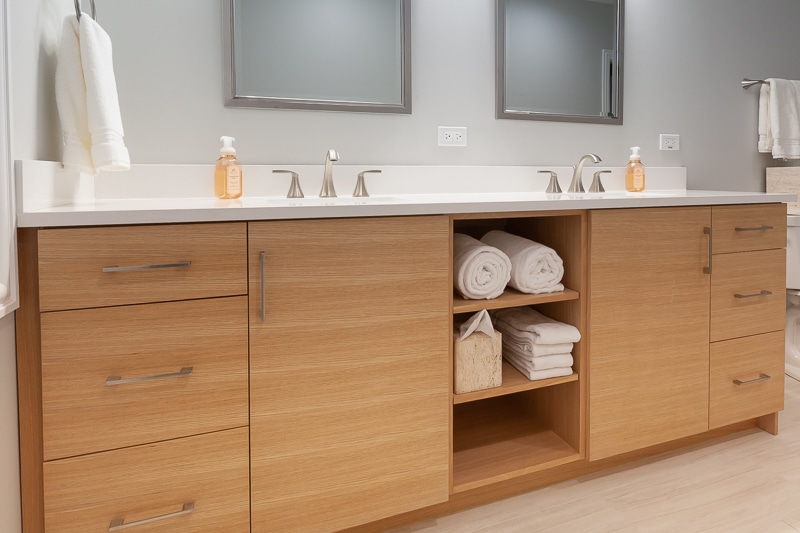
I want to click on left cabinet, so click(370, 334).